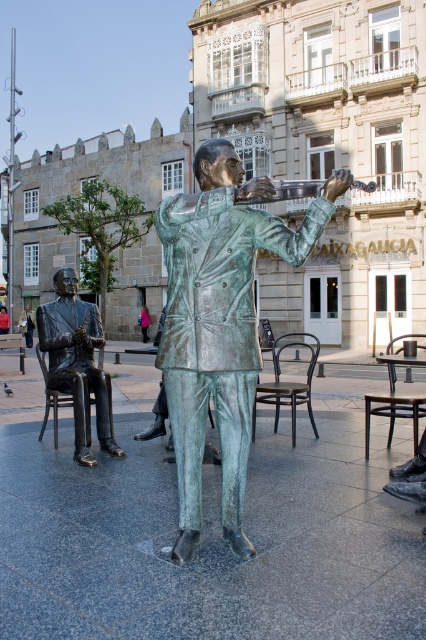
You are standing in the public square and want to take a photo of both the green patina statue at center and the bronze statue at left. Since you can only focus on one statue at a time, which statue should you position closer to the camera to ensure both are in the frame?

You should position the bronze statue at left closer to the camera because the green patina statue at center is to the right of it, so moving closer to the bronze statue at left will keep both statues within the camera frame.

You are standing in the public square and want to locate the green patina statue at center. According to the coordinates, where should you look? Please provide the coordinates in the format of a point like this example format point 0.5, 0.5.

The green patina statue at center is located at point (x=219, y=321).

You are standing in the public square looking at the two bronze statues. There are two points marked on the statues. One is at coordinate point (166, 349) and the other at point (63, 333). Which of these points is closer to you?

Point (166, 349) is closer to the camera than point (63, 333), so the point at coordinate point (166, 349) is closer to you.